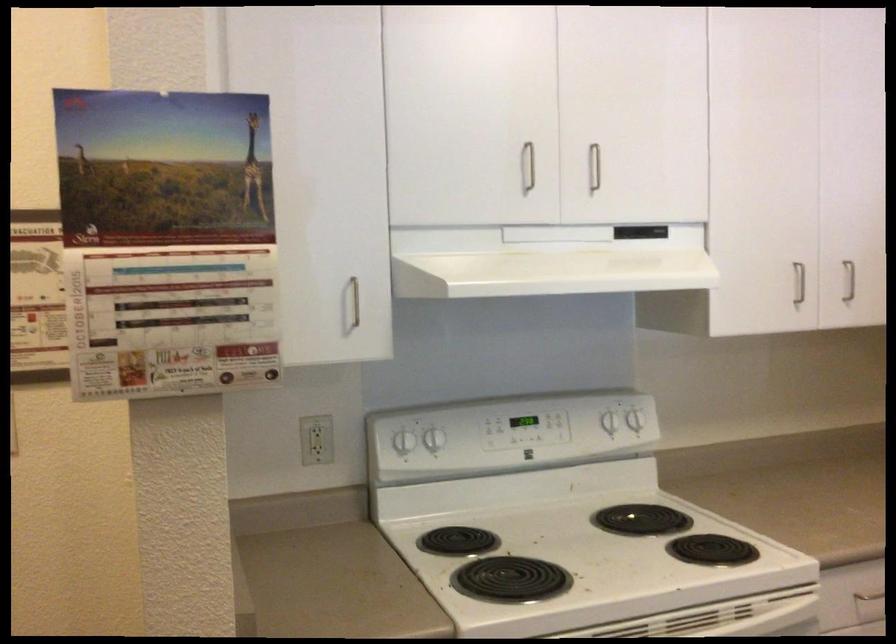
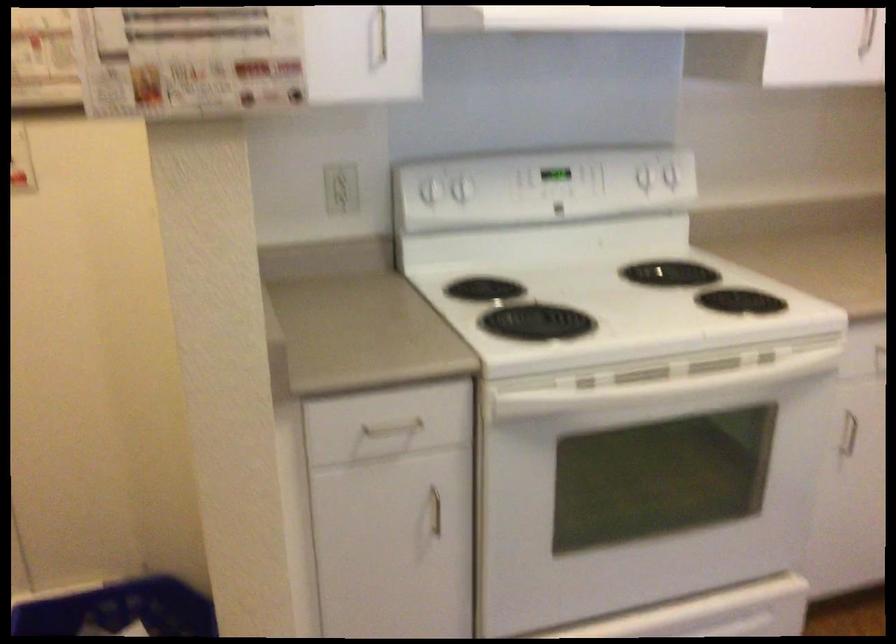
In a continuous first-person perspective shot, in which direction is the camera moving?

The movement direction of the cameraman is left, forward.